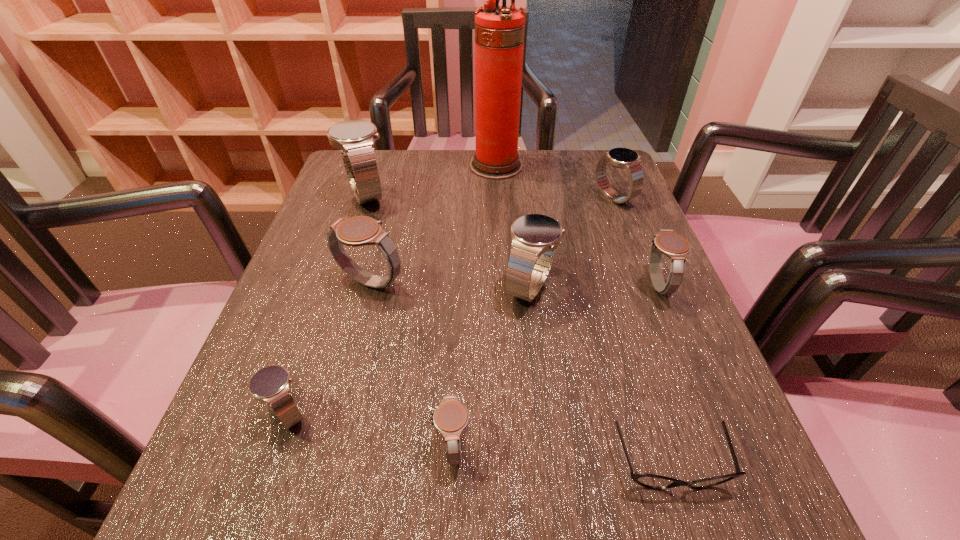
I want to click on vacant area situated 0.200m on the back of the second biggest gray watch, so click(624, 206).

The height and width of the screenshot is (540, 960). I want to click on vacant space located on the right of the smallest blue watch, so click(551, 413).

This screenshot has width=960, height=540. Find the location of `vacant space located on the back of the smallest gray watch`. vacant space located on the back of the smallest gray watch is located at coordinates (460, 289).

I want to click on free space located 0.050m on the front-facing side of the shortest object, so click(693, 539).

Find the location of a particular element. The image size is (960, 540). fire extinguisher at the far edge is located at coordinates (499, 29).

I want to click on watch that is at the near edge, so click(450, 418).

The height and width of the screenshot is (540, 960). What are the coordinates of `spectacles positioned at the near edge` in the screenshot? It's located at (647, 480).

The image size is (960, 540). What are the coordinates of `spectacles present at the right edge` in the screenshot? It's located at (647, 480).

In order to click on object at the far left corner in this screenshot , I will do `click(355, 138)`.

Locate an element on the screen. object situated at the far right corner is located at coordinates (624, 158).